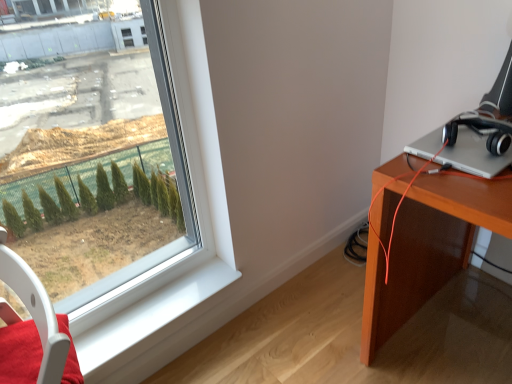
The width and height of the screenshot is (512, 384). In order to click on free point above white glossy window sill at lower left (from a real-world perspective) in this screenshot , I will do `click(154, 307)`.